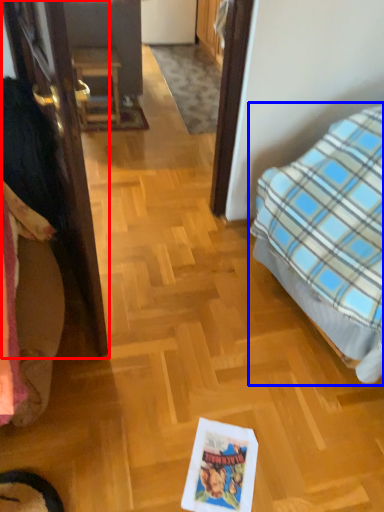
Question: Which object is closer to the camera taking this photo, door (highlighted by a red box) or bed (highlighted by a blue box)?

Choices:
 (A) door
 (B) bed

Answer: (B)